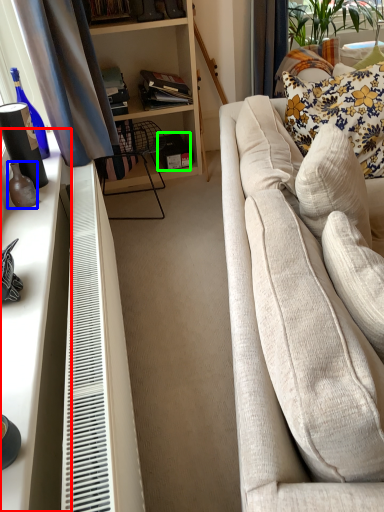
Question: Which is nearer to the desk (highlighted by a red box)? bottle (highlighted by a blue box) or box (highlighted by a green box).

Choices:
 (A) bottle
 (B) box

Answer: (A)